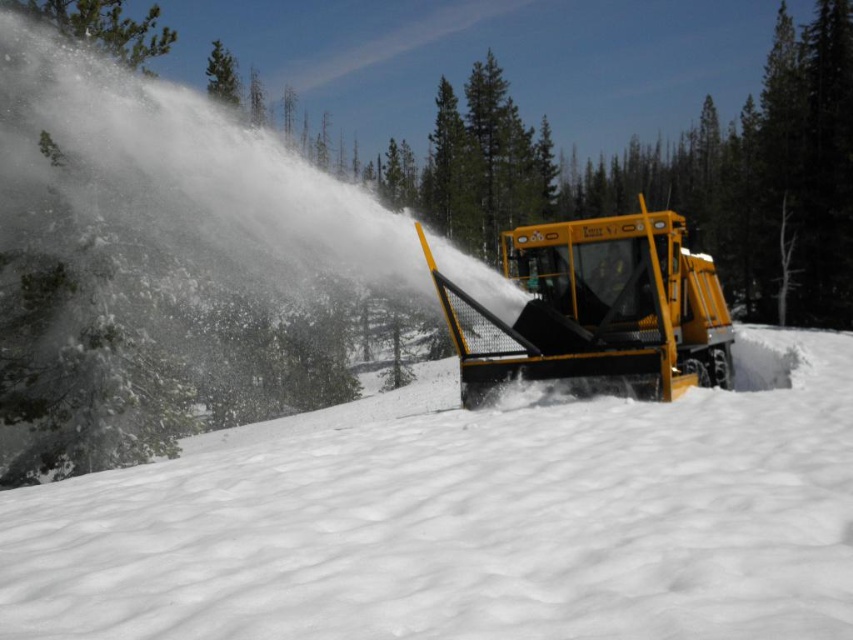
Question: Is white powdery snow at center wider than yellow metallic snowplow at center?

Choices:
 (A) yes
 (B) no

Answer: (A)

Question: Can you confirm if white powdery snow at center is positioned to the right of yellow metallic snowplow at center?

Choices:
 (A) yes
 (B) no

Answer: (B)

Question: Can you confirm if white powdery snow at center is positioned above yellow metallic snowplow at center?

Choices:
 (A) no
 (B) yes

Answer: (A)